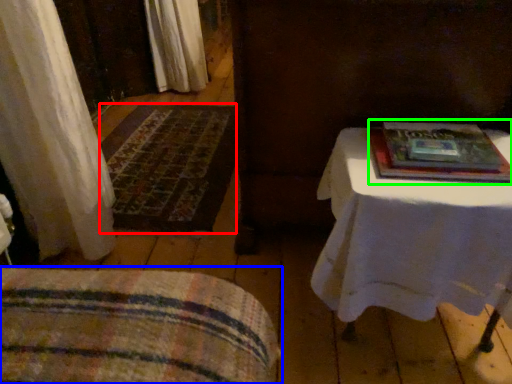
Question: Which object is the closest to the mat (highlighted by a red box)? Choose among these: furniture (highlighted by a blue box) or paperback book (highlighted by a green box).

Choices:
 (A) furniture
 (B) paperback book

Answer: (A)